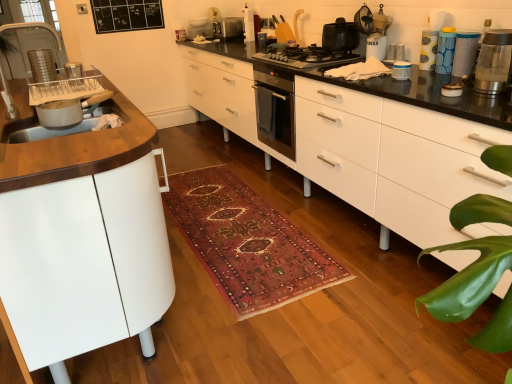
In order to click on clear glass water filter at upper right, the 1th kitchen appliance when ordered from front to back in this screenshot , I will do `click(493, 62)`.

What do you see at coordinates (465, 53) in the screenshot?
I see `matte plastic container at upper right, the 5th appliance viewed from the top` at bounding box center [465, 53].

This screenshot has width=512, height=384. What are the coordinates of `white glossy toaster at upper center, the 1th appliance viewed from the back` in the screenshot? It's located at coord(248,24).

At what (x,y) coordinates should I click in order to perform the action: click on black matte pot at center, which is the second kitchen appliance from back to front. Please return your answer as a coordinate pair (x, y). Looking at the image, I should click on coord(340,36).

Image resolution: width=512 pixels, height=384 pixels. In order to click on clear glass water filter at upper right, the 1th kitchen appliance when ordered from front to back in this screenshot , I will do `click(493, 62)`.

From the image's perspective, would you say white matte cabinet at left is shown under white glossy toaster at upper center, which is the 6th appliance from front to back?

Yes, from the image's perspective, white matte cabinet at left is below white glossy toaster at upper center, which is the 6th appliance from front to back.

Is point (140, 277) closer or farther from the camera than point (245, 4)?

Point (140, 277) is positioned closer to the camera compared to point (245, 4).

Which object is positioned more to the right, white matte cabinet at left or white glossy toaster at upper center, the 1th appliance from the left?

From the viewer's perspective, white glossy toaster at upper center, the 1th appliance from the left, appears more on the right side.

Identify the location of the 3rd kitchen appliance above the blue textured canister at upper right, the 2th appliance viewed from the right (from a real-world perspective). (340, 36).

Is black matte pot at center, arranged as the second kitchen appliance when viewed from the left, at the right side of blue textured canister at upper right, the 3th appliance positioned from the front?

In fact, black matte pot at center, arranged as the second kitchen appliance when viewed from the left, is to the left of blue textured canister at upper right, the 3th appliance positioned from the front.

Can you tell me how much black matte pot at center, which is the second kitchen appliance from back to front, and blue textured canister at upper right, the third appliance ordered from the bottom, differ in facing direction?

The angle between the facing direction of black matte pot at center, which is the second kitchen appliance from back to front, and the facing direction of blue textured canister at upper right, the third appliance ordered from the bottom, is 1.64 degrees.

From the image's perspective, relative to blue textured canister at upper right, the third appliance ordered from the bottom, is black matte pot at center, which is the second kitchen appliance from back to front, above or below?

From the image's perspective, black matte pot at center, which is the second kitchen appliance from back to front, appears above blue textured canister at upper right, the third appliance ordered from the bottom.

Between carpeted rug at center and white glossy chest of drawers at center, which one has larger width?

carpeted rug at center.

Choose the correct answer: Is carpeted rug at center inside white glossy chest of drawers at center or outside it?

carpeted rug at center exists outside the volume of white glossy chest of drawers at center.

From a real-world perspective, is carpeted rug at center on top of white glossy chest of drawers at center?

No.

From the image's perspective, is carpeted rug at center on white glossy chest of drawers at center?

Actually, carpeted rug at center appears below white glossy chest of drawers at center in the image.

Can we say matte white sink at left lies outside clear glass water filter at upper right, which is counted as the 3th kitchen appliance, starting from the back?

Yes, matte white sink at left is located beyond the bounds of clear glass water filter at upper right, which is counted as the 3th kitchen appliance, starting from the back.

From the image's perspective, is matte white sink at left located above or below clear glass water filter at upper right, which is the 1th kitchen appliance from bottom to top?

matte white sink at left is situated lower than clear glass water filter at upper right, which is the 1th kitchen appliance from bottom to top, in the image.

Does matte white sink at left turn towards clear glass water filter at upper right, the 1th kitchen appliance when ordered from front to back?

No.

Is white glossy toaster at upper center, which is the 6th appliance from front to back, facing away from white glossy container at upper right, the fifth appliance viewed from the back?

No, white glossy toaster at upper center, which is the 6th appliance from front to back, is not facing the opposite direction of white glossy container at upper right, the fifth appliance viewed from the back.

From a real-world perspective, is white glossy toaster at upper center, the sixth appliance from the right, below white glossy container at upper right, the fifth appliance viewed from the back?

No.

The height and width of the screenshot is (384, 512). Find the location of `the 5th appliance directly above the white glossy container at upper right, which is the 2th appliance in front-to-back order (from a real-world perspective)`. the 5th appliance directly above the white glossy container at upper right, which is the 2th appliance in front-to-back order (from a real-world perspective) is located at coordinates (248, 24).

Is point (246, 10) less distant than point (405, 64)?

No, it is behind (405, 64).

From the image's perspective, between blue textured canister at upper right, the third appliance ordered from the bottom, and yellow paper towel dispenser at upper right, which ranks as the 3th appliance in back-to-front order, who is located below?

blue textured canister at upper right, the third appliance ordered from the bottom, is shown below in the image.

Which object is closer to the camera taking this photo, blue textured canister at upper right, the 3th appliance positioned from the front, or yellow paper towel dispenser at upper right, which ranks as the 3th appliance in back-to-front order?

Positioned in front is blue textured canister at upper right, the 3th appliance positioned from the front.

Measure the distance from blue textured canister at upper right, the 3th appliance positioned from the front, to yellow paper towel dispenser at upper right, which ranks as the 3th appliance in back-to-front order.

blue textured canister at upper right, the 3th appliance positioned from the front, and yellow paper towel dispenser at upper right, which ranks as the 3th appliance in back-to-front order, are 7.02 centimeters apart from each other.

Is blue textured canister at upper right, the fourth appliance from the back, shorter than yellow paper towel dispenser at upper right, the fourth appliance in the bottom-to-top sequence?

No.

Is satin silver toaster at upper center, acting as the 3th kitchen appliance starting from the bottom, to the right of white glossy container at upper right, which is the 2th appliance in front-to-back order, from the viewer's perspective?

Incorrect, satin silver toaster at upper center, acting as the 3th kitchen appliance starting from the bottom, is not on the right side of white glossy container at upper right, which is the 2th appliance in front-to-back order.

Is satin silver toaster at upper center, the 3th kitchen appliance in the front-to-back sequence, wider or thinner than white glossy container at upper right, the fifth appliance viewed from the back?

Clearly, satin silver toaster at upper center, the 3th kitchen appliance in the front-to-back sequence, has more width compared to white glossy container at upper right, the fifth appliance viewed from the back.

Is satin silver toaster at upper center, which is the first kitchen appliance in left-to-right order, situated inside white glossy container at upper right, which is the 2th appliance in front-to-back order, or outside?

satin silver toaster at upper center, which is the first kitchen appliance in left-to-right order, is spatially situated outside white glossy container at upper right, which is the 2th appliance in front-to-back order.

Does satin silver toaster at upper center, the 1th kitchen appliance from the back, turn towards white glossy container at upper right, which is counted as the second appliance, starting from the left?

No.

Find the location of a particular element. cabinetry in front of the white glossy toaster at upper center, the 1th appliance from the left is located at coordinates (81, 236).

The image size is (512, 384). In order to click on the 3rd kitchen appliance above the blue textured canister at upper right, the 3th appliance positioned from the front (from a real-world perspective) in this screenshot , I will do `click(340, 36)`.

Consider the image. Based on their spatial positions, is clear glass water filter at upper right, which is counted as the third kitchen appliance, starting from the left, or white ceramic mug at upper center, which appears as the 3th appliance when viewed from the left, further from satin silver toaster at upper center, which ranks as the 3th kitchen appliance in right-to-left order?

clear glass water filter at upper right, which is counted as the third kitchen appliance, starting from the left, is positioned further to the anchor satin silver toaster at upper center, which ranks as the 3th kitchen appliance in right-to-left order.

Looking at the image, which one is located closer to satin silver toaster at upper center, acting as the 3th kitchen appliance starting from the bottom, white glossy container at upper right, which is the fifth appliance from right to left, or matte plastic container at upper right, acting as the 1th appliance starting from the front?

white glossy container at upper right, which is the fifth appliance from right to left, lies closer to satin silver toaster at upper center, acting as the 3th kitchen appliance starting from the bottom, than the other object.

Looking at the image, which one is located further to wooden countertop at left, matte white sink at left or black matte gas stove at center?

black matte gas stove at center lies further to wooden countertop at left than the other object.

Looking at the image, which one is located further to satin silver toaster at upper center, which ranks as the 3th kitchen appliance in right-to-left order, matte plastic container at upper right, which is the sixth appliance from back to front, or black matte gas stove at center?

matte plastic container at upper right, which is the sixth appliance from back to front, is positioned further to the anchor satin silver toaster at upper center, which ranks as the 3th kitchen appliance in right-to-left order.

Looking at the image, which one is located further to matte plastic container at upper right, placed as the first appliance when sorted from right to left, matte white sink at left or carpeted rug at center?

matte white sink at left lies further to matte plastic container at upper right, placed as the first appliance when sorted from right to left, than the other object.

Estimate the real-world distances between objects in this image. Which object is closer to clear glass water filter at upper right, placed as the third kitchen appliance when sorted from top to bottom, matte white sink at left or matte plastic container at upper right, the 5th appliance viewed from the top?

Among the two, matte plastic container at upper right, the 5th appliance viewed from the top, is located nearer to clear glass water filter at upper right, placed as the third kitchen appliance when sorted from top to bottom.

Which object lies further to the anchor point white glossy container at upper right, which is counted as the second appliance, starting from the left, blue textured canister at upper right, which is counted as the fifth appliance, starting from the left, or white glossy toaster at upper center, the 1th appliance from the left?

white glossy toaster at upper center, the 1th appliance from the left, lies further to white glossy container at upper right, which is counted as the second appliance, starting from the left, than the other object.

From the image, which object appears to be nearer to blue textured canister at upper right, which is counted as the fifth appliance, starting from the left, white glossy chest of drawers at center or white matte cabinet at left?

Among the two, white glossy chest of drawers at center is located nearer to blue textured canister at upper right, which is counted as the fifth appliance, starting from the left.

You are a GUI agent. You are given a task and a screenshot of the screen. Output one action in this format:
    pyautogui.click(x=<x>, y=<y>)
    Task: Click on the countertop positioned between white matte cabinet at left and white glossy toaster at upper center, the 6th appliance positioned from the bottom, from near to far
    This screenshot has height=384, width=512.
    Given the screenshot: What is the action you would take?
    pyautogui.click(x=70, y=144)

The image size is (512, 384). Identify the location of countertop between white glossy chest of drawers at center and black matte pot at center, the second kitchen appliance from the front, from front to back. (70, 144).

Identify the location of sink between clear glass water filter at upper right, placed as the third kitchen appliance when sorted from top to bottom, and white glossy toaster at upper center, the first appliance from the top, from front to back. (53, 128).

Find the location of `chest of drawers between white matte cabinet at left and blue textured canister at upper right, marked as the fourth appliance in a top-to-bottom arrangement`. chest of drawers between white matte cabinet at left and blue textured canister at upper right, marked as the fourth appliance in a top-to-bottom arrangement is located at coordinates (358, 143).